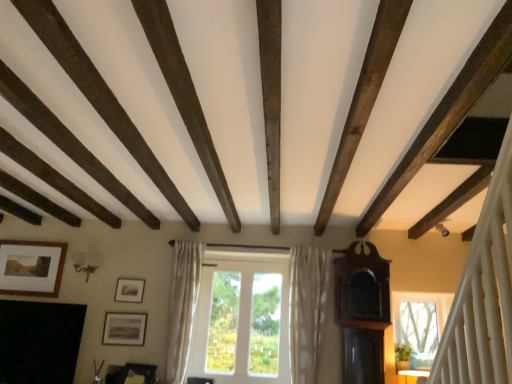
The height and width of the screenshot is (384, 512). Describe the element at coordinates (182, 305) in the screenshot. I see `white sheer curtain at center, the first curtain from the left` at that location.

Where is `matte black picture frame at lower left, placed as the second picture frame when sorted from left to right`? The height and width of the screenshot is (384, 512). matte black picture frame at lower left, placed as the second picture frame when sorted from left to right is located at coordinates (124, 329).

Locate an element on the screen. This screenshot has width=512, height=384. white dotted fabric curtain at center, marked as the 1th curtain in a right-to-left arrangement is located at coordinates (307, 309).

What is the approximate width of matte silver picture frame at center-left, which is the 2th picture frame from bottom to top?

matte silver picture frame at center-left, which is the 2th picture frame from bottom to top, is 1.28 inches in width.

Identify the location of matte silver picture frame at center-left, which is the 2th picture frame from bottom to top. The image size is (512, 384). (129, 290).

Where is `black matte fireplace at lower left`? The width and height of the screenshot is (512, 384). black matte fireplace at lower left is located at coordinates (39, 341).

Consider the image. From the image's perspective, is white sheer curtain at center, the first curtain from the left, located above or below matte black picture frame at lower left, which is the 2th picture frame in right-to-left order?

Based on their image positions, white sheer curtain at center, the first curtain from the left, is located above matte black picture frame at lower left, which is the 2th picture frame in right-to-left order.

Is white sheer curtain at center, the second curtain positioned from the right, facing towards matte black picture frame at lower left, the first picture frame ordered from the bottom?

No, white sheer curtain at center, the second curtain positioned from the right, is not turned towards matte black picture frame at lower left, the first picture frame ordered from the bottom.

Which is closer to the camera, (188, 264) or (144, 318)?

The point (144, 318) is in front.

Is matte black picture frame at lower left, the first picture frame ordered from the bottom, next to white dotted fabric curtain at center, which is the 2th curtain from left to right, and touching it?

No, matte black picture frame at lower left, the first picture frame ordered from the bottom, is not touching white dotted fabric curtain at center, which is the 2th curtain from left to right.

Which point is more distant from viewer, (105, 343) or (318, 283)?

The point (105, 343) is farther.

Which picture frame is the 1st one when counting from the back of the white dotted fabric curtain at center, marked as the 1th curtain in a right-to-left arrangement? Please provide its 2D coordinates.

[(124, 329)]

From a real-world perspective, is matte black picture frame at lower left, placed as the second picture frame when sorted from left to right, above or below white dotted fabric curtain at center, which is the 2th curtain from left to right?

From a real-world perspective, matte black picture frame at lower left, placed as the second picture frame when sorted from left to right, is physically below white dotted fabric curtain at center, which is the 2th curtain from left to right.

Considering the sizes of objects wooden framed picture at upper left, marked as the 3th picture frame in a bottom-to-top arrangement, and wooden picture frame at lower center in the image provided, who is bigger, wooden framed picture at upper left, marked as the 3th picture frame in a bottom-to-top arrangement, or wooden picture frame at lower center?

With larger size is wooden framed picture at upper left, marked as the 3th picture frame in a bottom-to-top arrangement.

Considering the sizes of objects wooden framed picture at upper left, the 3th picture frame when ordered from right to left, and wooden picture frame at lower center in the image provided, who is thinner, wooden framed picture at upper left, the 3th picture frame when ordered from right to left, or wooden picture frame at lower center?

With smaller width is wooden framed picture at upper left, the 3th picture frame when ordered from right to left.

In the scene shown: From the image's perspective, relative to wooden picture frame at lower center, is wooden framed picture at upper left, the first picture frame when ordered from top to bottom, above or below?

wooden framed picture at upper left, the first picture frame when ordered from top to bottom, is above wooden picture frame at lower center.

Is wooden picture frame at lower center inside wooden framed picture at upper left, the first picture frame when ordered from top to bottom?

No.

Based on the photo, from the image's perspective, does matte silver picture frame at center-left, arranged as the first picture frame when viewed from the right, appear higher than white sheer curtain at center, the first curtain from the left?

Yes, from the image's perspective, matte silver picture frame at center-left, arranged as the first picture frame when viewed from the right, is above white sheer curtain at center, the first curtain from the left.

Based on the photo, between matte silver picture frame at center-left, arranged as the first picture frame when viewed from the right, and white sheer curtain at center, the first curtain from the left, which one has smaller width?

matte silver picture frame at center-left, arranged as the first picture frame when viewed from the right.

Locate an element on the screen. Image resolution: width=512 pixels, height=384 pixels. picture frame that is the 1st one above the white sheer curtain at center, the first curtain from the left (from a real-world perspective) is located at coordinates (129, 290).

Can you confirm if matte silver picture frame at center-left, arranged as the third picture frame when viewed from the left, is positioned to the left of white sheer curtain at center, the second curtain positioned from the right?

Correct, you'll find matte silver picture frame at center-left, arranged as the third picture frame when viewed from the left, to the left of white sheer curtain at center, the second curtain positioned from the right.

Are black matte fireplace at lower left and white dotted fabric curtain at center, marked as the 1th curtain in a right-to-left arrangement, beside each other?

black matte fireplace at lower left is not next to white dotted fabric curtain at center, marked as the 1th curtain in a right-to-left arrangement, and they're not touching.

Who is taller, black matte fireplace at lower left or white dotted fabric curtain at center, marked as the 1th curtain in a right-to-left arrangement?

white dotted fabric curtain at center, marked as the 1th curtain in a right-to-left arrangement, is taller.

Locate an element on the screen. This screenshot has width=512, height=384. fireplace below the white dotted fabric curtain at center, which is the 2th curtain from left to right (from a real-world perspective) is located at coordinates (39, 341).

Is point (0, 368) positioned behind point (292, 276)?

No, (0, 368) is closer to viewer.

How different are the orientations of black matte fireplace at lower left and white glass window at center in degrees?

The facing directions of black matte fireplace at lower left and white glass window at center are 0.786 degrees apart.

In the scene shown: From the image's perspective, between black matte fireplace at lower left and white glass window at center, who is located below?

black matte fireplace at lower left is shown below in the image.

From a real-world perspective, is black matte fireplace at lower left positioned above or below white glass window at center?

Clearly, from a real-world perspective, black matte fireplace at lower left is below white glass window at center.

Considering the relative sizes of black matte fireplace at lower left and white glass window at center in the image provided, is black matte fireplace at lower left taller than white glass window at center?

In fact, black matte fireplace at lower left may be shorter than white glass window at center.

Between point (319, 345) and point (119, 322), which one is positioned in front?

Point (319, 345)

Is the position of white dotted fabric curtain at center, which is the 2th curtain from left to right, more distant than that of matte black picture frame at lower left, acting as the third picture frame starting from the top?

No, it is not.

Who is bigger, white dotted fabric curtain at center, which is the 2th curtain from left to right, or matte black picture frame at lower left, the first picture frame ordered from the bottom?

white dotted fabric curtain at center, which is the 2th curtain from left to right.

How many degrees apart are the facing directions of white dotted fabric curtain at center, which is the 2th curtain from left to right, and matte black picture frame at lower left, acting as the third picture frame starting from the top?

white dotted fabric curtain at center, which is the 2th curtain from left to right, and matte black picture frame at lower left, acting as the third picture frame starting from the top, are facing 1.51 degrees away from each other.

Identify the location of curtain that is the 1st one when counting rightward from the matte black picture frame at lower left, acting as the third picture frame starting from the top. The image size is (512, 384). (182, 305).

From a real-world perspective, which curtain is the 2nd one above the matte black picture frame at lower left, which is the 2th picture frame in right-to-left order? Please provide its 2D coordinates.

[(307, 309)]

Based on their spatial positions, is white dotted fabric curtain at center, which is the 2th curtain from left to right, or white glass window at center closer to matte black picture frame at lower left, placed as the second picture frame when sorted from left to right?

Based on the image, white glass window at center appears to be nearer to matte black picture frame at lower left, placed as the second picture frame when sorted from left to right.

Estimate the real-world distances between objects in this image. Which object is closer to black matte fireplace at lower left, wooden framed picture at upper left, the first picture frame when ordered from left to right, or wooden picture frame at lower center?

Among the two, wooden framed picture at upper left, the first picture frame when ordered from left to right, is located nearer to black matte fireplace at lower left.

When comparing their distances from wooden picture frame at lower center, does matte silver picture frame at center-left, arranged as the third picture frame when viewed from the left, or black matte fireplace at lower left seem further?

Among the two, black matte fireplace at lower left is located further to wooden picture frame at lower center.

Estimate the real-world distances between objects in this image. Which object is further from wooden framed picture at upper left, marked as the 3th picture frame in a bottom-to-top arrangement, white glass window at center or black matte fireplace at lower left?

Among the two, white glass window at center is located further to wooden framed picture at upper left, marked as the 3th picture frame in a bottom-to-top arrangement.

Which object lies further to the anchor point wooden framed picture at upper left, the first picture frame when ordered from left to right, black matte fireplace at lower left or matte black picture frame at lower left, which is the 2th picture frame in right-to-left order?

matte black picture frame at lower left, which is the 2th picture frame in right-to-left order, is positioned further to the anchor wooden framed picture at upper left, the first picture frame when ordered from left to right.

When comparing their distances from wooden framed picture at upper left, the first picture frame when ordered from left to right, does wooden picture frame at lower center or matte silver picture frame at center-left, arranged as the first picture frame when viewed from the right, seem closer?

The object closer to wooden framed picture at upper left, the first picture frame when ordered from left to right, is matte silver picture frame at center-left, arranged as the first picture frame when viewed from the right.

From the image, which object appears to be farther from white glass window at center, white sheer curtain at center, the second curtain positioned from the right, or wooden framed picture at upper left, the first picture frame when ordered from top to bottom?

wooden framed picture at upper left, the first picture frame when ordered from top to bottom, is positioned further to the anchor white glass window at center.

Which object lies further to the anchor point matte silver picture frame at center-left, acting as the 2th picture frame starting from the top, white dotted fabric curtain at center, which is the 2th curtain from left to right, or matte black picture frame at lower left, acting as the third picture frame starting from the top?

white dotted fabric curtain at center, which is the 2th curtain from left to right, lies further to matte silver picture frame at center-left, acting as the 2th picture frame starting from the top, than the other object.

What are the coordinates of `curtain located between black matte fireplace at lower left and white glass window at center in the left-right direction` in the screenshot? It's located at 182,305.

Locate an element on the screen. The height and width of the screenshot is (384, 512). fireplace situated between wooden framed picture at upper left, marked as the 3th picture frame in a bottom-to-top arrangement, and matte black picture frame at lower left, the first picture frame ordered from the bottom, from left to right is located at coordinates (39, 341).

Find the location of `picture frame between matte black picture frame at lower left, the first picture frame ordered from the bottom, and white glass window at center, in the horizontal direction`. picture frame between matte black picture frame at lower left, the first picture frame ordered from the bottom, and white glass window at center, in the horizontal direction is located at coordinates (129, 290).

Find the location of a particular element. picture frame between wooden framed picture at upper left, the first picture frame when ordered from top to bottom, and matte silver picture frame at center-left, arranged as the third picture frame when viewed from the left, from left to right is located at coordinates (124, 329).